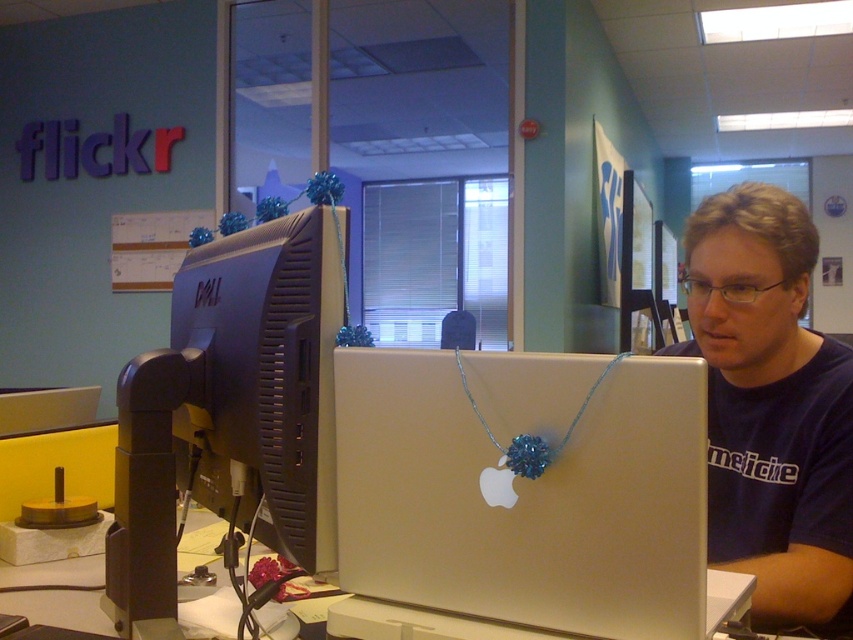
You are standing in front of the desk in the office scene. There are two points marked on the desk surface at coordinates point (201, 307) and point (99, 620). If you were to reach out to touch both points, which one would your hand encounter first?

Point (99, 620) is closer to you than point (201, 307), so your hand would encounter point (99, 620) first.

You are standing in the office and want to hand a document to the person sitting at the desk. Which object, the blue fabric shirt at center or the silver metallic computer desk at center, is closer to you when you approach them?

The blue fabric shirt at center is closer to the viewer than the silver metallic computer desk at center, so the shirt would be closer when you approach.